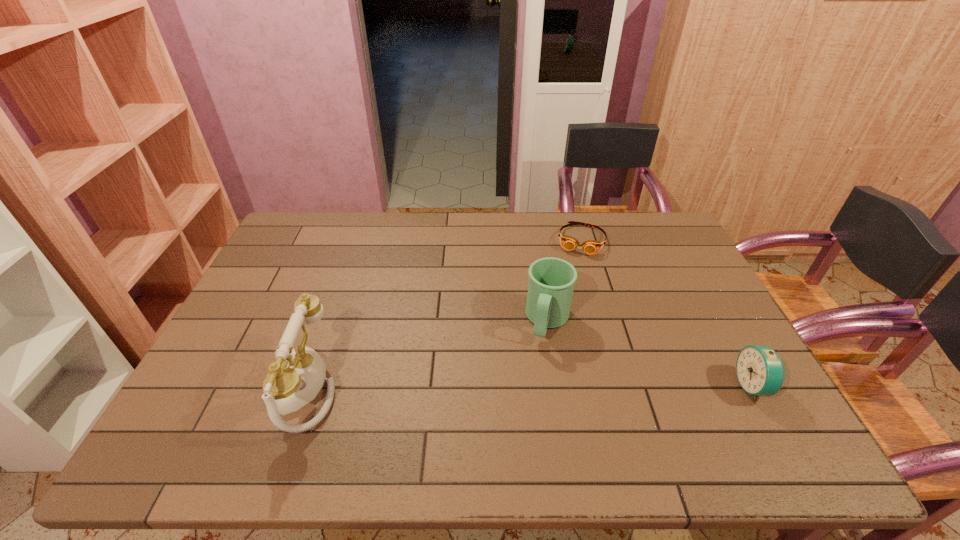
Identify the location of free space on the desktop that is between the leftmost object and the third tallest object and is positioned with the lenses facing forward on the shortest object. (546, 387).

Image resolution: width=960 pixels, height=540 pixels. Find the location of `vacant space on the desktop that is between the telephone and the alarm clock and is positioned on the side of the mug with the handle`. vacant space on the desktop that is between the telephone and the alarm clock and is positioned on the side of the mug with the handle is located at coordinates (529, 387).